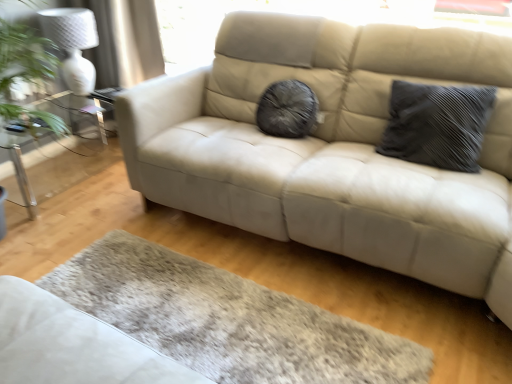
Question: Is white textured lamp at upper left a part of dark gray textured pillow at right?

Choices:
 (A) yes
 (B) no

Answer: (B)

Question: From the image's perspective, is dark gray textured pillow at right on top of white textured lamp at upper left?

Choices:
 (A) yes
 (B) no

Answer: (B)

Question: Is dark gray textured pillow at right closer to camera compared to white textured lamp at upper left?

Choices:
 (A) no
 (B) yes

Answer: (B)

Question: Does dark gray textured pillow at right have a smaller size compared to white textured lamp at upper left?

Choices:
 (A) no
 (B) yes

Answer: (A)

Question: Is dark gray textured pillow at right far away from white textured lamp at upper left?

Choices:
 (A) yes
 (B) no

Answer: (A)

Question: From the image's perspective, relative to dark gray textured pillow at right, is white textured lamp at upper left above or below?

Choices:
 (A) below
 (B) above

Answer: (B)

Question: Considering the positions of white textured lamp at upper left and dark gray textured pillow at right in the image, is white textured lamp at upper left wider or thinner than dark gray textured pillow at right?

Choices:
 (A) thin
 (B) wide

Answer: (B)

Question: Considering the positions of white textured lamp at upper left and dark gray textured pillow at right in the image, is white textured lamp at upper left taller or shorter than dark gray textured pillow at right?

Choices:
 (A) short
 (B) tall

Answer: (B)

Question: In the image, is white textured lamp at upper left positioned in front of or behind dark gray textured pillow at right?

Choices:
 (A) front
 (B) behind

Answer: (B)

Question: Is white textured lamp at upper left to the left or to the right of clear glass table at left in the image?

Choices:
 (A) right
 (B) left

Answer: (A)

Question: Considering the positions of white textured lamp at upper left and clear glass table at left in the image, is white textured lamp at upper left wider or thinner than clear glass table at left?

Choices:
 (A) thin
 (B) wide

Answer: (A)

Question: From a real-world perspective, is white textured lamp at upper left physically located above or below clear glass table at left?

Choices:
 (A) above
 (B) below

Answer: (A)

Question: In the image, is white textured lamp at upper left positioned in front of or behind clear glass table at left?

Choices:
 (A) front
 (B) behind

Answer: (B)

Question: From the image's perspective, is dark gray textured pillow at right positioned above or below clear glass table at left?

Choices:
 (A) above
 (B) below

Answer: (B)

Question: Do you think dark gray textured pillow at right is within clear glass table at left, or outside of it?

Choices:
 (A) inside
 (B) outside

Answer: (B)